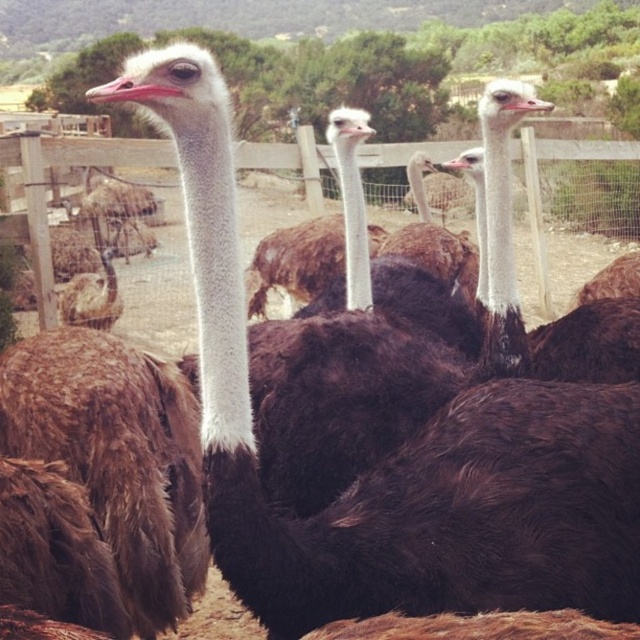
Question: Is brown fuzzy ostrich at upper right thinner than brown feathered ostrich at center?

Choices:
 (A) yes
 (B) no

Answer: (A)

Question: Which point is farther to the camera?

Choices:
 (A) wooden fence at center
 (B) brown feathered ostrich at center

Answer: (B)

Question: Which is nearer to the wooden fence at center?

Choices:
 (A) brown feathered ostrich at center
 (B) brown fuzzy ostrich at upper right

Answer: (A)

Question: Can you confirm if wooden fence at center is positioned to the left of brown fuzzy ostrich at upper right?

Choices:
 (A) no
 (B) yes

Answer: (B)

Question: Among these objects, which one is farthest from the camera?

Choices:
 (A) brown fuzzy ostrich at upper right
 (B) wooden fence at center

Answer: (B)

Question: Is wooden fence at center positioned at the back of brown feathered ostrich at center?

Choices:
 (A) no
 (B) yes

Answer: (A)